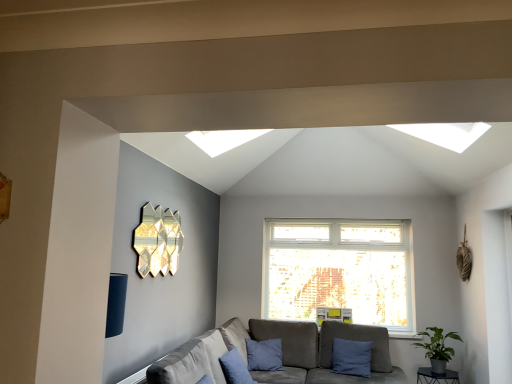
Consider the image. What is the approximate height of blue fabric pillow at lower right, arranged as the 1th pillow when viewed from the right?

It is 20.45 inches.

You are a GUI agent. You are given a task and a screenshot of the screen. Output one action in this format:
    pyautogui.click(x=<x>, y=<y>)
    Task: Click on the metallic black table at lower right
    The width and height of the screenshot is (512, 384).
    Given the screenshot: What is the action you would take?
    pyautogui.click(x=436, y=376)

Can metallic black table at lower right be found inside green matte plant at lower right?

Definitely not — metallic black table at lower right is not inside green matte plant at lower right.

Based on the photo, which is more distant, (443, 364) or (453, 380)?

Point (443, 364)

Consider the image. In the image, is green matte plant at lower right on the left side or the right side of metallic black table at lower right?

From the image, it's evident that green matte plant at lower right is to the left of metallic black table at lower right.

At what (x,y) coordinates should I click in order to perform the action: click on houseplant on the left side of metallic black table at lower right. Please return your answer as a coordinate pair (x, y). The height and width of the screenshot is (384, 512). Looking at the image, I should click on (438, 349).

Does blue fabric pillow at lower right, the second pillow positioned from the left, have a lesser height compared to gray fabric couch at lower center?

Indeed, blue fabric pillow at lower right, the second pillow positioned from the left, has a lesser height compared to gray fabric couch at lower center.

Is blue fabric pillow at lower right, the second pillow positioned from the left, turned away from gray fabric couch at lower center?

Yes, blue fabric pillow at lower right, the second pillow positioned from the left,'s orientation is away from gray fabric couch at lower center.

Which of these two, blue fabric pillow at lower right, the second pillow positioned from the left, or gray fabric couch at lower center, is smaller?

blue fabric pillow at lower right, the second pillow positioned from the left.

Is blue cotton pillow at lower center, the 2th pillow viewed from the back, positioned beyond the bounds of green matte plant at lower right?

blue cotton pillow at lower center, the 2th pillow viewed from the back, is positioned outside green matte plant at lower right.

Considering the sizes of objects blue cotton pillow at lower center, which ranks as the first pillow in left-to-right order, and green matte plant at lower right in the image provided, who is bigger, blue cotton pillow at lower center, which ranks as the first pillow in left-to-right order, or green matte plant at lower right?

With larger size is green matte plant at lower right.

Considering their positions, is blue cotton pillow at lower center, positioned as the 2th pillow in right-to-left order, located in front of or behind green matte plant at lower right?

In the image, blue cotton pillow at lower center, positioned as the 2th pillow in right-to-left order, appears in front of green matte plant at lower right.

Is point (233, 367) positioned after point (429, 327)?

That is False.

Which is less distant, (151, 244) or (365, 351)?

Point (151, 244).

How far apart are gold metallic wall art at upper left and blue fabric pillow at lower right, arranged as the first pillow when viewed from the back?

gold metallic wall art at upper left is 7.28 feet from blue fabric pillow at lower right, arranged as the first pillow when viewed from the back.

Is gold metallic wall art at upper left to the right of blue fabric pillow at lower right, the second pillow positioned from the left, from the viewer's perspective?

No.

Is blue fabric pillow at lower right, which is the second pillow in front-to-back order, surrounded by gold metallic wall art at upper left?

No, blue fabric pillow at lower right, which is the second pillow in front-to-back order, is not surrounded by gold metallic wall art at upper left.

Locate an element on the screen. The width and height of the screenshot is (512, 384). lamp above the gray fabric couch at lower center (from the image's perspective) is located at coordinates (158, 241).

Considering the sizes of gray fabric couch at lower center and gold metallic wall art at upper left in the image, is gray fabric couch at lower center taller or shorter than gold metallic wall art at upper left?

Clearly, gray fabric couch at lower center is taller compared to gold metallic wall art at upper left.

Between gray fabric couch at lower center and gold metallic wall art at upper left, which one is positioned behind?

gold metallic wall art at upper left.

Which object is positioned more to the left, gray fabric couch at lower center or gold metallic wall art at upper left?

Positioned to the left is gold metallic wall art at upper left.

Based on the photo, from the image's perspective, which object appears higher, gray fabric couch at lower center or blue cotton pillow at lower center, the 2th pillow viewed from the back?

blue cotton pillow at lower center, the 2th pillow viewed from the back, is shown above in the image.

Considering the sizes of objects gray fabric couch at lower center and blue cotton pillow at lower center, positioned as the first pillow in front-to-back order, in the image provided, who is thinner, gray fabric couch at lower center or blue cotton pillow at lower center, positioned as the first pillow in front-to-back order,?

blue cotton pillow at lower center, positioned as the first pillow in front-to-back order.

Between gray fabric couch at lower center and blue cotton pillow at lower center, positioned as the 2th pillow in right-to-left order, which one has more height?

gray fabric couch at lower center is taller.

Does green matte plant at lower right turn towards gray fabric couch at lower center?

No.

Considering the sizes of objects green matte plant at lower right and gray fabric couch at lower center in the image provided, who is bigger, green matte plant at lower right or gray fabric couch at lower center?

With larger size is gray fabric couch at lower center.

Locate an element on the screen. houseplant above the gray fabric couch at lower center (from a real-world perspective) is located at coordinates (438, 349).

Which of these two, green matte plant at lower right or gray fabric couch at lower center, is thinner?

green matte plant at lower right.

Where is `table below the green matte plant at lower right (from a real-world perspective)`? table below the green matte plant at lower right (from a real-world perspective) is located at coordinates (436, 376).

This screenshot has width=512, height=384. Identify the location of pillow that appears on the right of gray fabric couch at lower center. (351, 357).

When comparing their distances from gold metallic wall art at upper left, does gray fabric couch at lower center or green matte plant at lower right seem closer?

Based on the image, gray fabric couch at lower center appears to be nearer to gold metallic wall art at upper left.

Estimate the real-world distances between objects in this image. Which object is closer to green matte plant at lower right, gold metallic wall art at upper left or blue fabric pillow at lower right, arranged as the first pillow when viewed from the back?

Among the two, blue fabric pillow at lower right, arranged as the first pillow when viewed from the back, is located nearer to green matte plant at lower right.

From the image, which object appears to be farther from gold metallic wall art at upper left, gray fabric couch at lower center or metallic black table at lower right?

metallic black table at lower right is positioned further to the anchor gold metallic wall art at upper left.

From the image, which object appears to be nearer to metallic black table at lower right, blue fabric pillow at lower right, arranged as the 1th pillow when viewed from the right, or gray fabric couch at lower center?

blue fabric pillow at lower right, arranged as the 1th pillow when viewed from the right, lies closer to metallic black table at lower right than the other object.

When comparing their distances from blue fabric pillow at lower right, the second pillow positioned from the left, does blue cotton pillow at lower center, positioned as the 2th pillow in right-to-left order, or green matte plant at lower right seem further?

Based on the image, blue cotton pillow at lower center, positioned as the 2th pillow in right-to-left order, appears to be further to blue fabric pillow at lower right, the second pillow positioned from the left.

Considering their positions, is metallic black table at lower right positioned closer to blue fabric pillow at lower right, arranged as the first pillow when viewed from the back, than green matte plant at lower right?

metallic black table at lower right lies closer to blue fabric pillow at lower right, arranged as the first pillow when viewed from the back, than the other object.

Considering their positions, is gold metallic wall art at upper left positioned further to blue cotton pillow at lower center, positioned as the first pillow in front-to-back order, than green matte plant at lower right?

Among the two, green matte plant at lower right is located further to blue cotton pillow at lower center, positioned as the first pillow in front-to-back order.

Estimate the real-world distances between objects in this image. Which object is further from blue cotton pillow at lower center, positioned as the 2th pillow in right-to-left order, gold metallic wall art at upper left or gray fabric couch at lower center?

gold metallic wall art at upper left is positioned further to the anchor blue cotton pillow at lower center, positioned as the 2th pillow in right-to-left order.

Image resolution: width=512 pixels, height=384 pixels. Identify the location of lamp between gray fabric couch at lower center and blue fabric pillow at lower right, arranged as the 1th pillow when viewed from the right, from front to back. (158, 241).

What are the coordinates of `houseplant positioned between gray fabric couch at lower center and blue fabric pillow at lower right, arranged as the first pillow when viewed from the back, from near to far` in the screenshot? It's located at (438, 349).

I want to click on pillow situated between blue cotton pillow at lower center, positioned as the 2th pillow in right-to-left order, and green matte plant at lower right from left to right, so click(351, 357).

At what (x,y) coordinates should I click in order to perform the action: click on houseplant located between gray fabric couch at lower center and metallic black table at lower right in the depth direction. Please return your answer as a coordinate pair (x, y). Looking at the image, I should click on (438, 349).